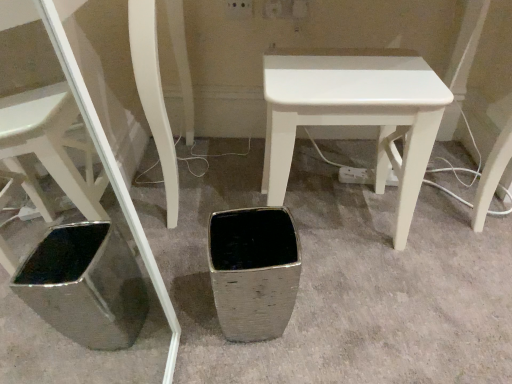
Image resolution: width=512 pixels, height=384 pixels. I want to click on white glossy stool at center, so click(x=354, y=113).

What do you see at coordinates (354, 113) in the screenshot? I see `white glossy stool at center` at bounding box center [354, 113].

What are the coordinates of `white glossy stool at center` in the screenshot? It's located at (354, 113).